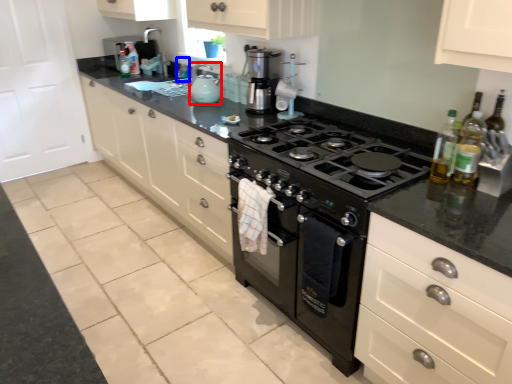
Question: Among these objects, which one is farthest to the camera, kitchen appliance (highlighted by a red box) or bottle (highlighted by a blue box)?

Choices:
 (A) kitchen appliance
 (B) bottle

Answer: (B)